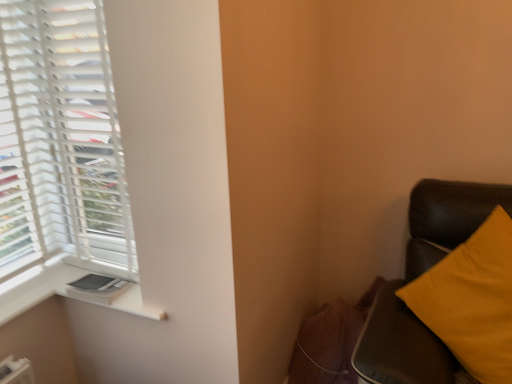
Identify the location of matte yellow pillow at right. (418, 276).

The width and height of the screenshot is (512, 384). What do you see at coordinates (134, 304) in the screenshot?
I see `white plastic window sill at lower left` at bounding box center [134, 304].

Identify the location of matte yellow pillow at right. (418, 276).

Is matte yellow pillow at right oriented away from white plastic window sill at lower left?

matte yellow pillow at right is not turned away from white plastic window sill at lower left.

Is matte yellow pillow at right positioned beyond the bounds of white plastic window sill at lower left?

Yes.

Considering the relative positions of matte yellow pillow at right and white plastic window sill at lower left in the image provided, is matte yellow pillow at right to the left of white plastic window sill at lower left from the viewer's perspective?

No, matte yellow pillow at right is not to the left of white plastic window sill at lower left.

Between point (355, 362) and point (132, 294), which one is positioned behind?

The point (132, 294) is farther.

Which is in front, point (5, 210) or point (146, 309)?

The point (146, 309) is closer to the camera.

How many degrees apart are the facing directions of white matte blinds at left and white plastic window sill at lower left?

The angle between the facing direction of white matte blinds at left and the facing direction of white plastic window sill at lower left is 90 degrees.

Does white matte blinds at left have a greater width compared to white plastic window sill at lower left?

No, white matte blinds at left is not wider than white plastic window sill at lower left.

Considering the relative sizes of white matte blinds at left and white plastic window sill at lower left in the image provided, is white matte blinds at left shorter than white plastic window sill at lower left?

No.

From a real-world perspective, is white plastic window sill at lower left on top of matte yellow pillow at right?

No.

Is white plastic window sill at lower left behind matte yellow pillow at right?

Yes.

In the scene shown: Is white plastic window sill at lower left turned away from matte yellow pillow at right?

That's not correct — white plastic window sill at lower left is not looking away from matte yellow pillow at right.

Choose the correct answer: Is white plastic window sill at lower left inside matte yellow pillow at right or outside it?

white plastic window sill at lower left lies outside matte yellow pillow at right.

Considering the sizes of objects matte yellow pillow at right and white matte blinds at left in the image provided, who is shorter, matte yellow pillow at right or white matte blinds at left?

Standing shorter between the two is matte yellow pillow at right.

From the image's perspective, is matte yellow pillow at right positioned above or below white matte blinds at left?

Based on their image positions, matte yellow pillow at right is located beneath white matte blinds at left.

Locate an element on the screen. The height and width of the screenshot is (384, 512). furniture lying on the right of white matte blinds at left is located at coordinates (418, 276).

Is matte yellow pillow at right located outside white matte blinds at left?

Yes.

How many degrees apart are the facing directions of white matte blinds at left and matte yellow pillow at right?

The facing directions of white matte blinds at left and matte yellow pillow at right are 1.19 degrees apart.

From a real-world perspective, which object stands above the other?

white matte blinds at left is physically above.

Does white matte blinds at left have a lesser height compared to matte yellow pillow at right?

No.

Measure the distance from white plastic window sill at lower left to white matte blinds at left.

A distance of 23.15 inches exists between white plastic window sill at lower left and white matte blinds at left.

Is white plastic window sill at lower left next to white matte blinds at left and touching it?

white plastic window sill at lower left and white matte blinds at left are clearly separated.

From a real-world perspective, does white plastic window sill at lower left stand above white matte blinds at left?

No, from a real-world perspective, white plastic window sill at lower left is not above white matte blinds at left.

Considering the positions of point (136, 284) and point (106, 212), is point (136, 284) closer or farther from the camera than point (106, 212)?

Clearly, point (136, 284) is closer to the camera than point (106, 212).

The image size is (512, 384). Identify the location of window sill below the matte yellow pillow at right (from the image's perspective). (134, 304).

Where is `window in front of the white plastic window sill at lower left`? This screenshot has height=384, width=512. window in front of the white plastic window sill at lower left is located at coordinates (61, 141).

When comparing their distances from white plastic window sill at lower left, does white matte blinds at left or matte yellow pillow at right seem closer?

white matte blinds at left is positioned closer to the anchor white plastic window sill at lower left.

When comparing their distances from matte yellow pillow at right, does white plastic window sill at lower left or white matte blinds at left seem closer?

white plastic window sill at lower left lies closer to matte yellow pillow at right than the other object.

Considering their positions, is matte yellow pillow at right positioned closer to white plastic window sill at lower left than white matte blinds at left?

white matte blinds at left.

Which object lies further to the anchor point matte yellow pillow at right, white matte blinds at left or white plastic window sill at lower left?

The object further to matte yellow pillow at right is white matte blinds at left.

Which object lies further to the anchor point white matte blinds at left, matte yellow pillow at right or white plastic window sill at lower left?

The object further to white matte blinds at left is matte yellow pillow at right.

Which object lies nearer to the anchor point white matte blinds at left, white plastic window sill at lower left or matte yellow pillow at right?

white plastic window sill at lower left.

Image resolution: width=512 pixels, height=384 pixels. I want to click on window sill between white matte blinds at left and matte yellow pillow at right from left to right, so click(134, 304).